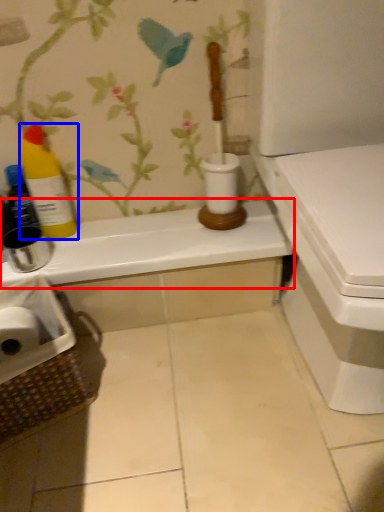
Question: Which object is closer to the camera taking this photo, counter top (highlighted by a red box) or bottle (highlighted by a blue box)?

Choices:
 (A) counter top
 (B) bottle

Answer: (B)